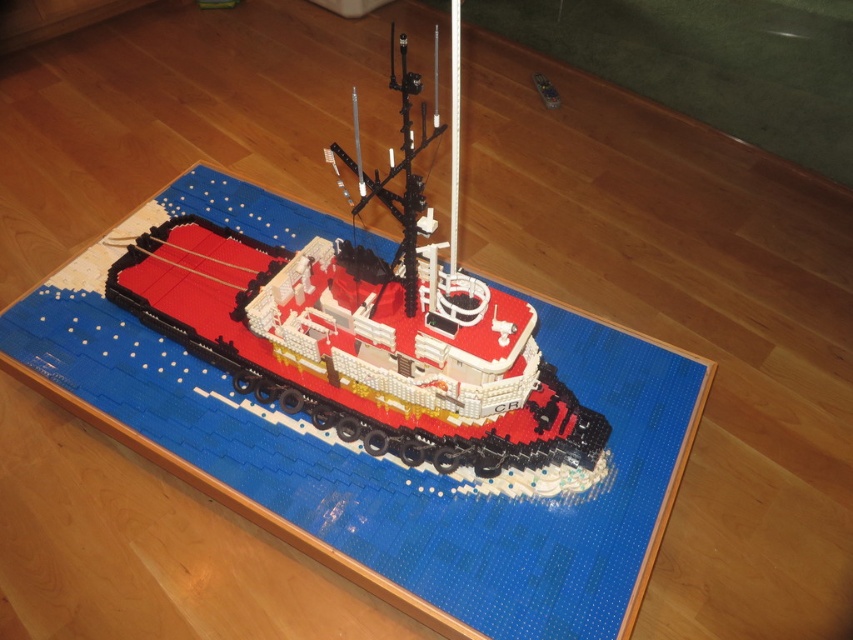
Question: Is blue plastic mat at center bigger than brick red plastic boat at center?

Choices:
 (A) no
 (B) yes

Answer: (A)

Question: Which point is farther to the camera?

Choices:
 (A) blue plastic mat at center
 (B) brick red plastic boat at center

Answer: (A)

Question: Which object is farther from the camera taking this photo?

Choices:
 (A) blue plastic mat at center
 (B) brick red plastic boat at center

Answer: (A)

Question: Does blue plastic mat at center appear over brick red plastic boat at center?

Choices:
 (A) yes
 (B) no

Answer: (B)

Question: Observing the image, what is the correct spatial positioning of blue plastic mat at center in reference to brick red plastic boat at center?

Choices:
 (A) right
 (B) left

Answer: (B)